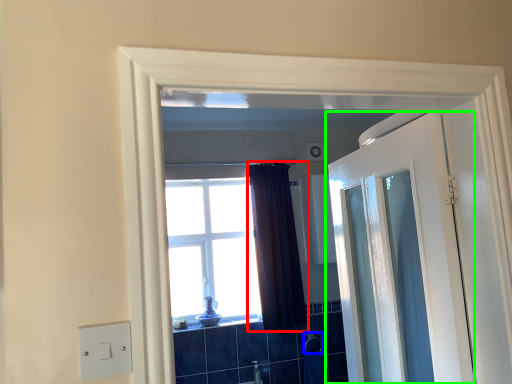
Question: Considering the real-world distances, which object is farthest from curtain (highlighted by a red box)? towel bar (highlighted by a blue box) or door (highlighted by a green box)?

Choices:
 (A) towel bar
 (B) door

Answer: (B)